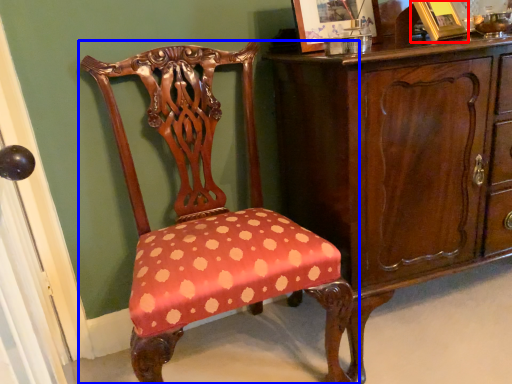
Question: Which of the following is the closest to the observer, picture frame (highlighted by a red box) or chair (highlighted by a blue box)?

Choices:
 (A) picture frame
 (B) chair

Answer: (B)